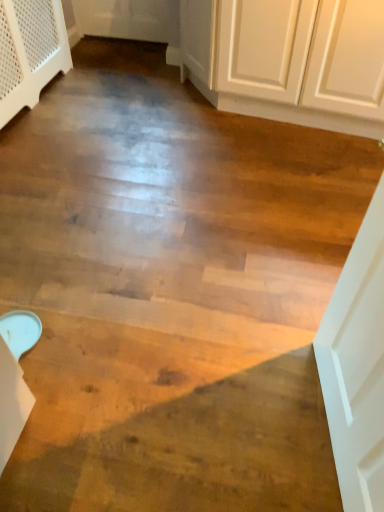
Find the location of `free location to the left of white matte door at right`. free location to the left of white matte door at right is located at coordinates (243, 414).